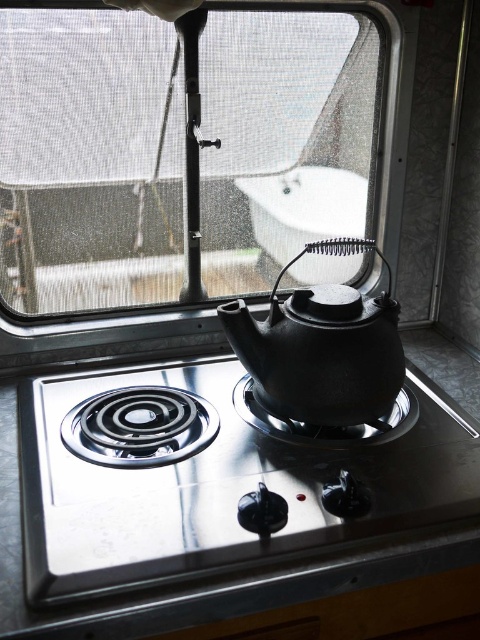
Question: Estimate the real-world distances between objects in this image. Which object is farther from the black cast iron teapot at center?

Choices:
 (A) satin silver gas stove at center
 (B) transparent mesh at upper center

Answer: (B)

Question: Can you confirm if transparent mesh at upper center is smaller than satin silver gas stove at center?

Choices:
 (A) yes
 (B) no

Answer: (B)

Question: Is transparent mesh at upper center bigger than satin silver gas stove at center?

Choices:
 (A) yes
 (B) no

Answer: (A)

Question: In this image, where is transparent mesh at upper center located relative to satin silver gas stove at center?

Choices:
 (A) below
 (B) above

Answer: (B)

Question: Estimate the real-world distances between objects in this image. Which object is farther from the black cast iron teapot at center?

Choices:
 (A) transparent mesh at upper center
 (B) satin silver gas stove at center

Answer: (A)

Question: Which point is closer to the camera?

Choices:
 (A) (207, 388)
 (B) (240, 20)

Answer: (B)